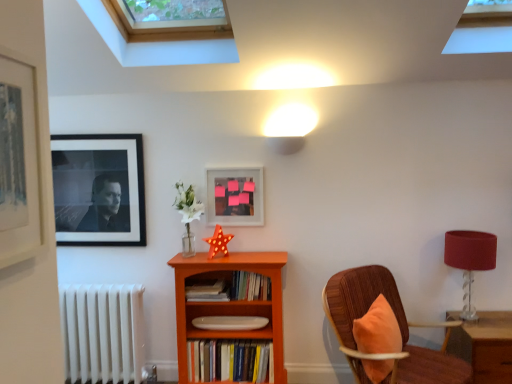
Question: Is the position of white metallic radiator at lower left more distant than that of orange wood bookcase at center?

Choices:
 (A) no
 (B) yes

Answer: (B)

Question: Can you confirm if white metallic radiator at lower left is smaller than orange wood bookcase at center?

Choices:
 (A) yes
 (B) no

Answer: (A)

Question: Is white metallic radiator at lower left in front of orange wood bookcase at center?

Choices:
 (A) yes
 (B) no

Answer: (B)

Question: From a real-world perspective, is white metallic radiator at lower left positioned under orange wood bookcase at center based on gravity?

Choices:
 (A) no
 (B) yes

Answer: (B)

Question: Considering the relative sizes of white metallic radiator at lower left and orange wood bookcase at center in the image provided, is white metallic radiator at lower left wider than orange wood bookcase at center?

Choices:
 (A) no
 (B) yes

Answer: (A)

Question: Considering the positions of point (124, 299) and point (204, 286), is point (124, 299) closer or farther from the camera than point (204, 286)?

Choices:
 (A) farther
 (B) closer

Answer: (B)

Question: Would you say white metallic radiator at lower left is to the left or to the right of hardcover book at center, the 2th book when ordered from bottom to top, in the picture?

Choices:
 (A) right
 (B) left

Answer: (B)

Question: From the image's perspective, is white metallic radiator at lower left positioned above or below hardcover book at center, the 2th book when ordered from bottom to top?

Choices:
 (A) above
 (B) below

Answer: (B)

Question: From their relative heights in the image, would you say white metallic radiator at lower left is taller or shorter than hardcover book at center, the 2th book when ordered from bottom to top?

Choices:
 (A) short
 (B) tall

Answer: (B)

Question: In terms of size, does matte glass picture frame at center, which is counted as the first picture frame, starting from the right, appear bigger or smaller than hardcover book at center, the second book from the top?

Choices:
 (A) small
 (B) big

Answer: (A)

Question: Is matte glass picture frame at center, which is counted as the first picture frame, starting from the right, in front of or behind hardcover book at center, the second book from the top, in the image?

Choices:
 (A) front
 (B) behind

Answer: (B)

Question: Is matte glass picture frame at center, arranged as the 3th picture frame when viewed from the left, wider or thinner than hardcover book at center, the 2th book when ordered from bottom to top?

Choices:
 (A) thin
 (B) wide

Answer: (A)

Question: Do you think matte glass picture frame at center, marked as the second picture frame in a back-to-front arrangement, is within hardcover book at center, the second book from the top, or outside of it?

Choices:
 (A) inside
 (B) outside

Answer: (B)

Question: Considering the positions of point (351, 334) and point (134, 339), is point (351, 334) closer or farther from the camera than point (134, 339)?

Choices:
 (A) farther
 (B) closer

Answer: (B)

Question: Is wooden chair with orange cushion at right taller or shorter than white metallic radiator at lower left?

Choices:
 (A) tall
 (B) short

Answer: (A)